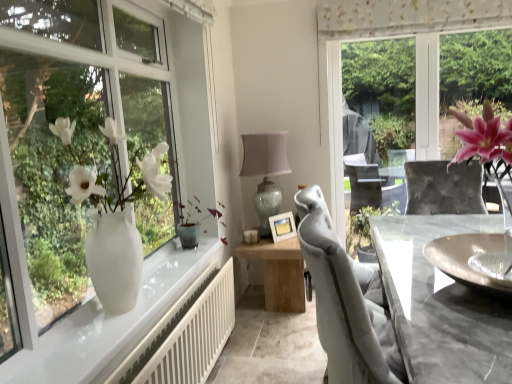
Question: From the image's perspective, does wooden table at center appear lower than matte glass table lamp at center?

Choices:
 (A) no
 (B) yes

Answer: (B)

Question: Is matte glass table lamp at center surrounded by wooden table at center?

Choices:
 (A) yes
 (B) no

Answer: (B)

Question: Does wooden table at center appear on the left side of matte glass table lamp at center?

Choices:
 (A) yes
 (B) no

Answer: (B)

Question: Does wooden table at center come behind matte glass table lamp at center?

Choices:
 (A) yes
 (B) no

Answer: (B)

Question: Considering the relative sizes of wooden table at center and matte glass table lamp at center in the image provided, is wooden table at center taller than matte glass table lamp at center?

Choices:
 (A) yes
 (B) no

Answer: (B)

Question: Is wooden table at center situated inside matte glass table lamp at center or outside?

Choices:
 (A) inside
 (B) outside

Answer: (B)

Question: In terms of height, does wooden table at center look taller or shorter compared to matte glass table lamp at center?

Choices:
 (A) tall
 (B) short

Answer: (B)

Question: From the image's perspective, relative to matte glass table lamp at center, is wooden table at center above or below?

Choices:
 (A) above
 (B) below

Answer: (B)

Question: Considering their positions, is wooden table at center located in front of or behind matte glass table lamp at center?

Choices:
 (A) front
 (B) behind

Answer: (A)

Question: From a real-world perspective, relative to white glossy vase at left, is wooden table at center vertically above or below?

Choices:
 (A) above
 (B) below

Answer: (B)

Question: In terms of height, does wooden table at center look taller or shorter compared to white glossy vase at left?

Choices:
 (A) tall
 (B) short

Answer: (B)

Question: From the image's perspective, is wooden table at center located above or below white glossy vase at left?

Choices:
 (A) below
 (B) above

Answer: (A)

Question: Is wooden table at center bigger or smaller than white glossy vase at left?

Choices:
 (A) big
 (B) small

Answer: (A)

Question: In terms of height, does pink flower vase at right look taller or shorter compared to wooden table at center?

Choices:
 (A) tall
 (B) short

Answer: (A)

Question: Is pink flower vase at right inside or outside of wooden table at center?

Choices:
 (A) inside
 (B) outside

Answer: (B)